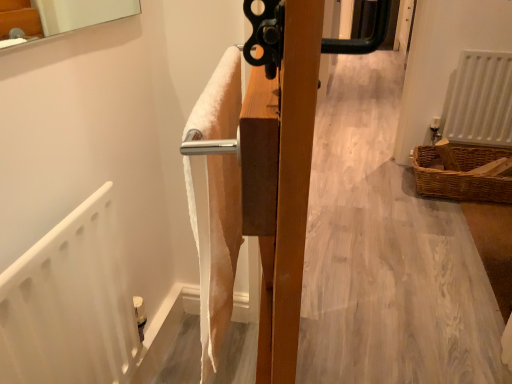
Question: Do you think brown woven basket at lower right is within white matte radiator at right, or outside of it?

Choices:
 (A) outside
 (B) inside

Answer: (A)

Question: Is brown woven basket at lower right to the left or to the right of white matte radiator at right in the image?

Choices:
 (A) left
 (B) right

Answer: (A)

Question: Does point (416, 178) appear closer or farther from the camera than point (499, 94)?

Choices:
 (A) closer
 (B) farther

Answer: (A)

Question: Is point (466, 84) closer or farther from the camera than point (470, 185)?

Choices:
 (A) closer
 (B) farther

Answer: (B)

Question: Relative to brown woven basket at lower right, is white matte radiator at right in front or behind?

Choices:
 (A) front
 (B) behind

Answer: (B)

Question: Looking at their shapes, would you say white matte radiator at right is wider or thinner than brown woven basket at lower right?

Choices:
 (A) wide
 (B) thin

Answer: (B)

Question: Would you say white matte radiator at right is inside or outside brown woven basket at lower right?

Choices:
 (A) outside
 (B) inside

Answer: (A)